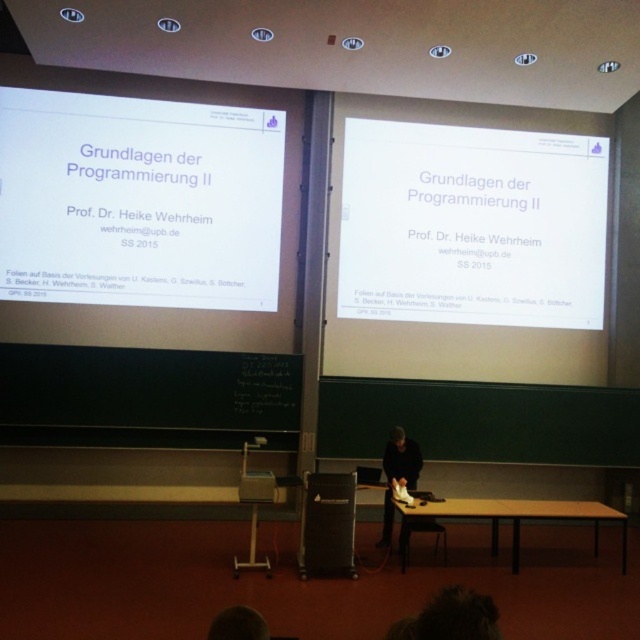
Based on the scene description, what object is located at the coordinates point (x=472, y=225)?

The object at point (x=472, y=225) is the white matte projector screen at upper center.

You are standing in the lecture hall and want to move to the point at coordinates point [45,109]. If your walking distance is limited to 20 feet, can you reach it?

The distance of point [45,109] from camera is 25.04 feet, so you cannot reach it within 20 feet.

You are setting up for a presentation in the lecture hall and need to place a laptop next to the white matte projector screen at upper left. Based on the coordinates provided, where should you position the laptop relative to the screen?

The white matte projector screen at upper left is located at point (138,202), so you should position the laptop to the right or below the screen to ensure it doesn not obstruct the projection area.